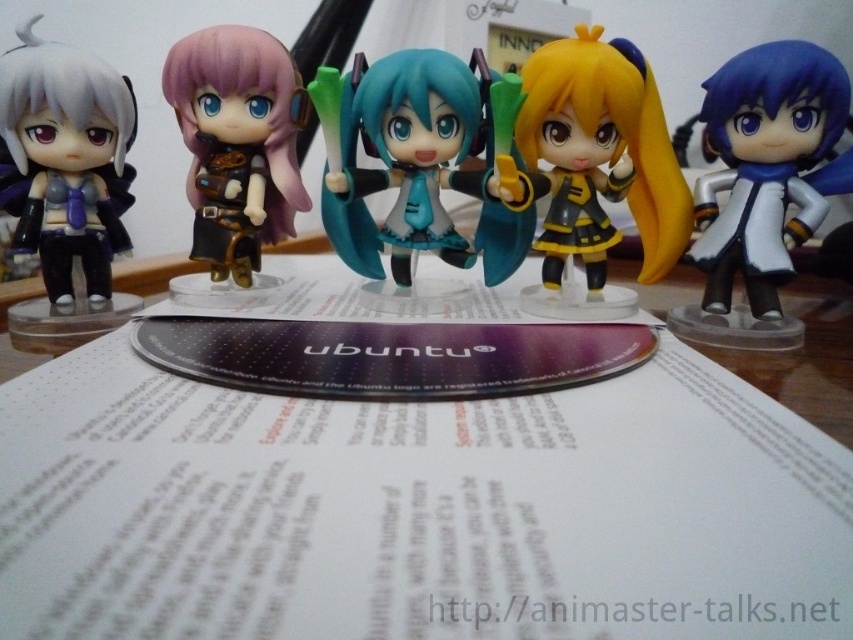
Question: Is white paper at center below white glossy figure at right?

Choices:
 (A) no
 (B) yes

Answer: (B)

Question: Which point is closer to the camera?

Choices:
 (A) (120, 243)
 (B) (86, 422)
 (C) (531, 292)

Answer: (B)

Question: Which point is closer to the camera?

Choices:
 (A) matte gold armor at center
 (B) white paper at center

Answer: (B)

Question: Can you confirm if semi-glossy plastic figure at center is thinner than white glossy figure at right?

Choices:
 (A) no
 (B) yes

Answer: (A)

Question: Where is white paper at center located in relation to matte gold armor at center in the image?

Choices:
 (A) below
 (B) above

Answer: (A)

Question: Which point is closer to the camera?

Choices:
 (A) (743, 104)
 (B) (453, 68)
 (C) (625, 461)
 (D) (283, 173)

Answer: (C)